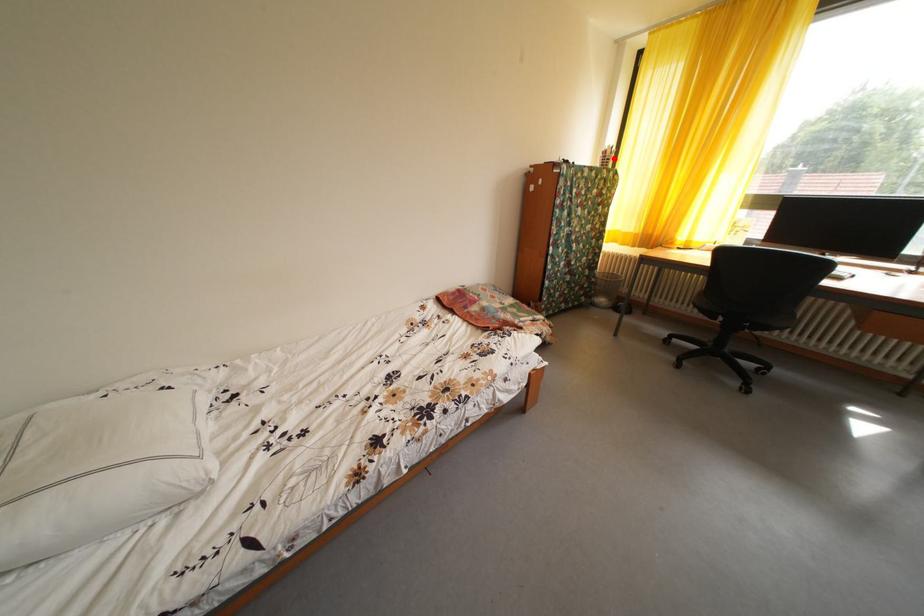
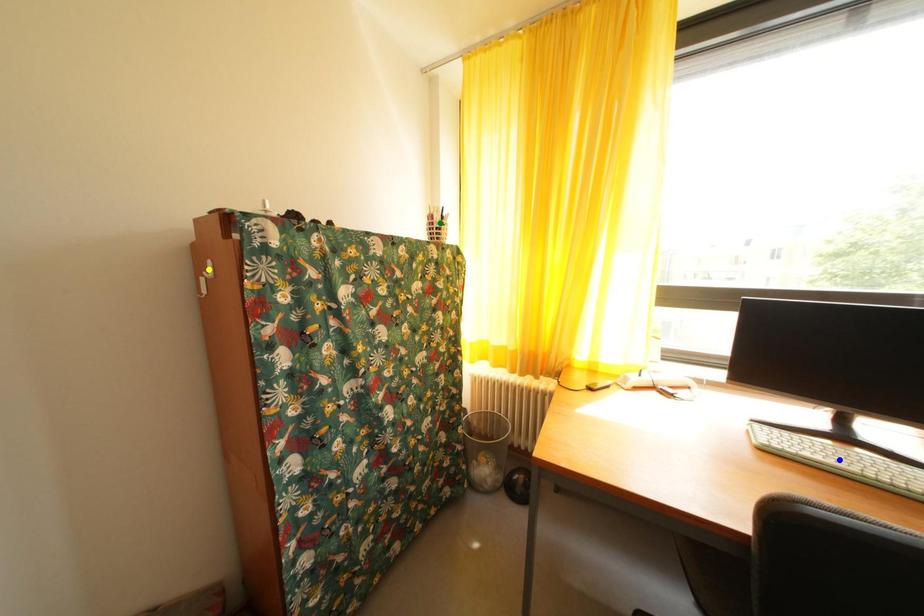
Question: I am providing you with two images of the same scene from different viewpoints. A red point is marked on the first image. You are given multiple points on the second image. Which mark in image 2 goes with the point in image 1?

Choices:
 (A) yellow point
 (B) blue point
 (C) green point

Answer: (C)